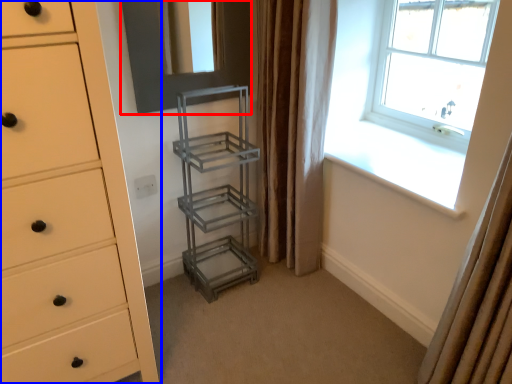
Question: Which object appears closest to the camera in this image, screen door (highlighted by a red box) or chest of drawers (highlighted by a blue box)?

Choices:
 (A) screen door
 (B) chest of drawers

Answer: (B)